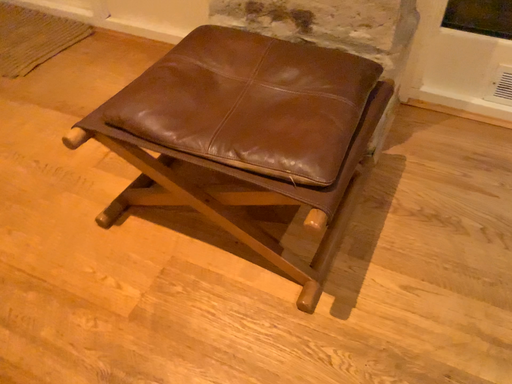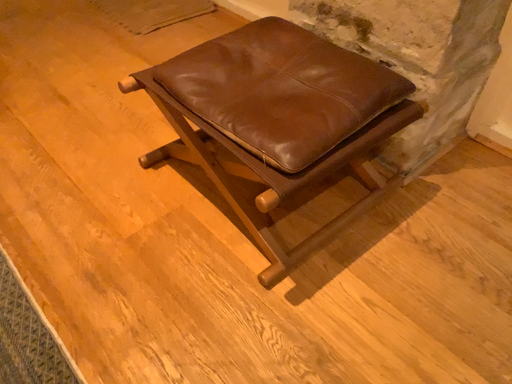
Question: How did the camera likely rotate when shooting the video?

Choices:
 (A) rotated right
 (B) rotated left

Answer: (B)